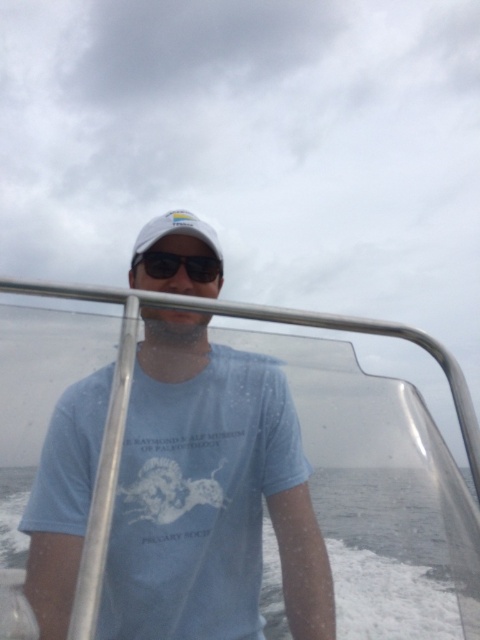
You are a photographer on a boat and want to capture the white foam at lower center in your shot. Where should you position your camera relative to the boat? Please provide coordinates in the format of x,y where x and y are between 0 and 1.

The white foam at lower center is located at coordinates [387,554]. Position your camera at that point to capture it.

You are a photographer trying to capture the matte white cap at center from a distance. What coordinates should you aim your camera at to ensure the cap is in the frame?

You should aim your camera at the coordinates point (208, 496) to capture the matte white cap at center.